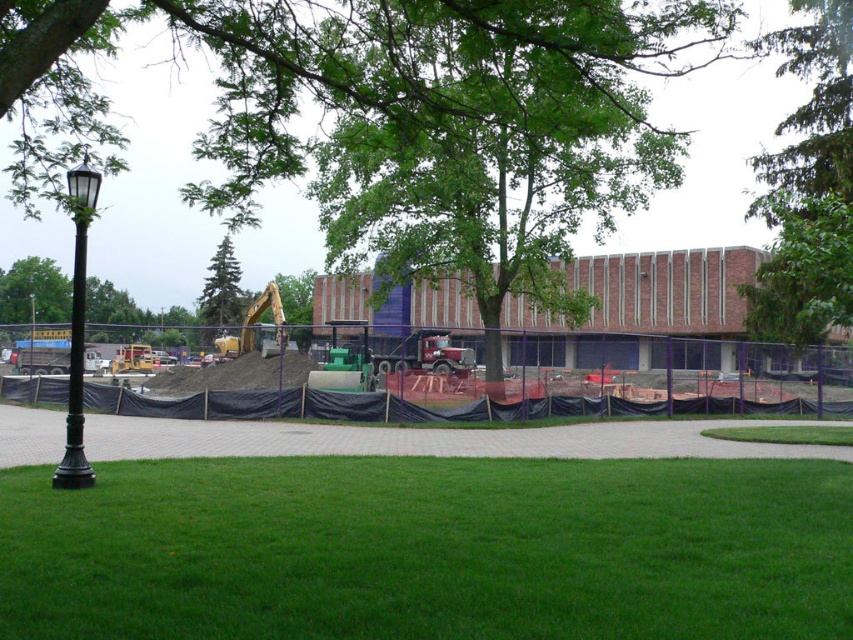
A gardener wants to plant a new tree in the green grass at lower center. The tree requires a minimum of 100 feet of space between it and the green leafy tree at center to thrive. Based on the scene description, will the proposed planting location meet this requirement?

The green grass at lower center and green leafy tree at center are 132.59 feet apart from each other, which exceeds the required 100 feet of space. Therefore, planting the new tree in the green grass at lower center will meet the requirement.

You are a landscape architect planning to add a new pathway between the green leafy tree at left and the green textured pine tree at upper left. Which tree should you place closer to the construction site to ensure the pathway is visible from the black lamppost on the left?

The green leafy tree at left is closer to the construction site because it is further to the viewer than the green textured pine tree at upper left. Placing it closer ensures the pathway remains visible from the black lamppost on the left.

You are standing at the camera position and want to reach both the point at coordinates [822,504] and the point at [305,337]. Which point will you reach first as you move forward?

You will reach the point at coordinates [822,504] first because it is closer to the camera than the point at [305,337].